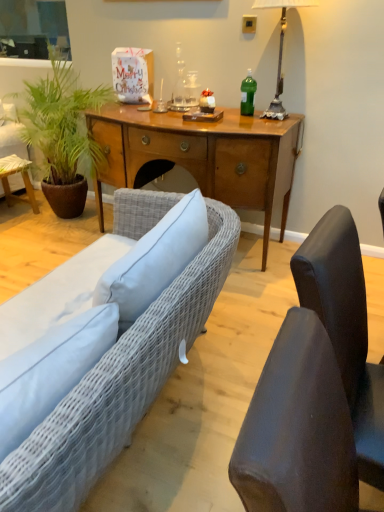
The width and height of the screenshot is (384, 512). Identify the location of wooden desk at center. (202, 156).

The width and height of the screenshot is (384, 512). Describe the element at coordinates (297, 428) in the screenshot. I see `matte gray chair at right, acting as the 2th chair starting from the back` at that location.

What is the approximate width of matte gray chair at right, acting as the 2th chair starting from the back?

11.34 inches.

The image size is (384, 512). What do you see at coordinates (118, 385) in the screenshot?
I see `woven fabric couch at lower left` at bounding box center [118, 385].

Identify the location of woven fabric couch at lower left. (118, 385).

The image size is (384, 512). Identify the location of wooden desk at center. (202, 156).

In the image, is green plastic bottle at center positioned in front of or behind wooden desk at center?

green plastic bottle at center is positioned farther from the viewer than wooden desk at center.

Can we say green plastic bottle at center lies outside wooden desk at center?

Yes, green plastic bottle at center is outside of wooden desk at center.

From the image's perspective, which one is positioned lower, green plastic bottle at center or wooden desk at center?

wooden desk at center is shown below in the image.

From the image's perspective, is matte gray chair at right, the first chair viewed from the front, located above or below green leafy plant at left?

matte gray chair at right, the first chair viewed from the front, is situated lower than green leafy plant at left in the image.

Considering the relative positions of matte gray chair at right, acting as the 2th chair starting from the back, and green leafy plant at left in the image provided, is matte gray chair at right, acting as the 2th chair starting from the back, behind green leafy plant at left?

No, matte gray chair at right, acting as the 2th chair starting from the back, is in front of green leafy plant at left.

From a real-world perspective, count 2nd chairs downward from the green leafy plant at left and point to it. Please provide its 2D coordinates.

[(297, 428)]

Consider the image. From the image's perspective, is matte gray chair at right, acting as the 2th chair starting from the back, located above woven fabric couch at lower left?

No, from the image's perspective, matte gray chair at right, acting as the 2th chair starting from the back, is not above woven fabric couch at lower left.

Is matte gray chair at right, the first chair viewed from the front, taller or shorter than woven fabric couch at lower left?

Clearly, matte gray chair at right, the first chair viewed from the front, is taller compared to woven fabric couch at lower left.

Is matte gray chair at right, the first chair viewed from the front, not within woven fabric couch at lower left?

matte gray chair at right, the first chair viewed from the front, lies outside woven fabric couch at lower left's area.

What are the coordinates of `studio couch located underneath the matte gray chair at right, acting as the 2th chair starting from the back (from a real-world perspective)` in the screenshot? It's located at coord(118,385).

Could you tell me if metallic silver lamp at upper right is facing dark gray fabric chair at right, which appears as the 1th chair when viewed from the back?

No.

At what (x,y) coordinates should I click in order to perform the action: click on lamp above the dark gray fabric chair at right, which appears as the 1th chair when viewed from the back (from the image's perspective). Please return your answer as a coordinate pair (x, y). The height and width of the screenshot is (512, 384). Looking at the image, I should click on (280, 51).

Who is taller, metallic silver lamp at upper right or dark gray fabric chair at right, which appears as the 1th chair when viewed from the back?

With more height is dark gray fabric chair at right, which appears as the 1th chair when viewed from the back.

Which is more to the right, metallic silver lamp at upper right or dark gray fabric chair at right, which appears as the 1th chair when viewed from the back?

From the viewer's perspective, metallic silver lamp at upper right appears more on the right side.

Is point (301, 504) closer to viewer compared to point (245, 88)?

Yes, point (301, 504) is closer to viewer.

Considering the relative positions of matte gray chair at right, acting as the 2th chair starting from the back, and green plastic bottle at center in the image provided, is matte gray chair at right, acting as the 2th chair starting from the back, in front of green plastic bottle at center?

Yes, matte gray chair at right, acting as the 2th chair starting from the back, is closer to the viewer.

Is matte gray chair at right, the first chair viewed from the front, oriented towards green plastic bottle at center?

No, matte gray chair at right, the first chair viewed from the front, does not turn towards green plastic bottle at center.

Is matte gray chair at right, the first chair viewed from the front, inside the boundaries of green plastic bottle at center, or outside?

matte gray chair at right, the first chair viewed from the front, is not inside green plastic bottle at center, it's outside.

Does metallic silver lamp at upper right appear on the right side of green leafy plant at left?

Yes, metallic silver lamp at upper right is to the right of green leafy plant at left.

Is metallic silver lamp at upper right not inside green leafy plant at left?

Yes, metallic silver lamp at upper right is not within green leafy plant at left.

How distant is metallic silver lamp at upper right from green leafy plant at left?

metallic silver lamp at upper right is 1.40 meters from green leafy plant at left.

Can you confirm if matte gray chair at right, acting as the 2th chair starting from the back, is shorter than dark gray fabric chair at right, which appears as the 1th chair when viewed from the back?

In fact, matte gray chair at right, acting as the 2th chair starting from the back, may be taller than dark gray fabric chair at right, which appears as the 1th chair when viewed from the back.

I want to click on chair above the matte gray chair at right, acting as the 2th chair starting from the back (from the image's perspective), so click(345, 328).

Would you consider matte gray chair at right, the first chair viewed from the front, to be distant from dark gray fabric chair at right, which appears as the 1th chair when viewed from the back?

No, matte gray chair at right, the first chair viewed from the front, is in close proximity to dark gray fabric chair at right, which appears as the 1th chair when viewed from the back.

Is matte gray chair at right, acting as the 2th chair starting from the back, looking in the opposite direction of dark gray fabric chair at right, which ranks as the second chair in front-to-back order?

That's not correct — matte gray chair at right, acting as the 2th chair starting from the back, is not looking away from dark gray fabric chair at right, which ranks as the second chair in front-to-back order.

You are a GUI agent. You are given a task and a screenshot of the screen. Output one action in this format:
    pyautogui.click(x=<x>, y=<y>)
    Task: Click on the bottle lying above the wooden desk at center (from the image's perspective)
    The image size is (384, 512).
    Given the screenshot: What is the action you would take?
    pyautogui.click(x=248, y=94)

From a real-world perspective, count 2nd chairs downward from the green leafy plant at left and point to it. Please provide its 2D coordinates.

[(297, 428)]

When comparing their distances from wooden desk at center, does matte gray chair at right, acting as the 2th chair starting from the back, or dark gray fabric chair at right, which ranks as the second chair in front-to-back order, seem closer?

dark gray fabric chair at right, which ranks as the second chair in front-to-back order, is positioned closer to the anchor wooden desk at center.

From the image, which object appears to be nearer to woven fabric couch at lower left, wooden desk at center or dark gray fabric chair at right, which appears as the 1th chair when viewed from the back?

dark gray fabric chair at right, which appears as the 1th chair when viewed from the back.

Considering their positions, is wooden desk at center positioned closer to dark gray fabric chair at right, which ranks as the second chair in front-to-back order, than woven fabric couch at lower left?

woven fabric couch at lower left is closer to dark gray fabric chair at right, which ranks as the second chair in front-to-back order.

Considering their positions, is dark gray fabric chair at right, which ranks as the second chair in front-to-back order, positioned closer to green leafy plant at left than wooden desk at center?

The object closer to green leafy plant at left is wooden desk at center.

Considering their positions, is dark gray fabric chair at right, which ranks as the second chair in front-to-back order, positioned further to metallic silver lamp at upper right than woven fabric couch at lower left?

Among the two, dark gray fabric chair at right, which ranks as the second chair in front-to-back order, is located further to metallic silver lamp at upper right.

From the image, which object appears to be farther from green plastic bottle at center, green leafy plant at left or metallic silver lamp at upper right?

Among the two, green leafy plant at left is located further to green plastic bottle at center.

Considering their positions, is matte gray chair at right, acting as the 2th chair starting from the back, positioned closer to wooden desk at center than woven fabric couch at lower left?

woven fabric couch at lower left.

Based on their spatial positions, is green leafy plant at left or woven fabric couch at lower left closer to green plastic bottle at center?

The object closer to green plastic bottle at center is green leafy plant at left.

The width and height of the screenshot is (384, 512). I want to click on studio couch between green leafy plant at left and metallic silver lamp at upper right from left to right, so click(118, 385).

What are the coordinates of `studio couch located between dark gray fabric chair at right, which appears as the 1th chair when viewed from the back, and wooden desk at center in the depth direction` in the screenshot? It's located at (118, 385).

Where is `chair located between matte gray chair at right, acting as the 2th chair starting from the back, and wooden desk at center in the depth direction`? Image resolution: width=384 pixels, height=512 pixels. chair located between matte gray chair at right, acting as the 2th chair starting from the back, and wooden desk at center in the depth direction is located at coordinates (345, 328).

Image resolution: width=384 pixels, height=512 pixels. Find the location of `studio couch between matte gray chair at right, acting as the 2th chair starting from the back, and wooden desk at center from front to back`. studio couch between matte gray chair at right, acting as the 2th chair starting from the back, and wooden desk at center from front to back is located at coordinates (118, 385).